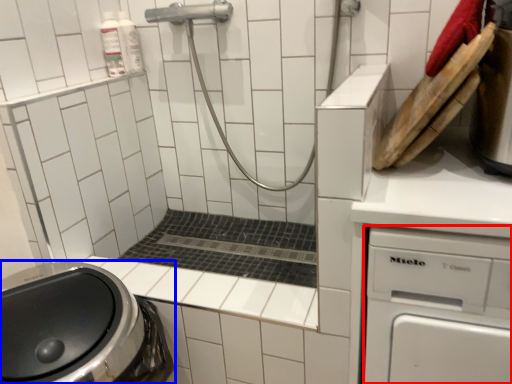
Question: Which of the following is the farthest to the observer, dish washer (highlighted by a red box) or washing machine (highlighted by a blue box)?

Choices:
 (A) dish washer
 (B) washing machine

Answer: (B)